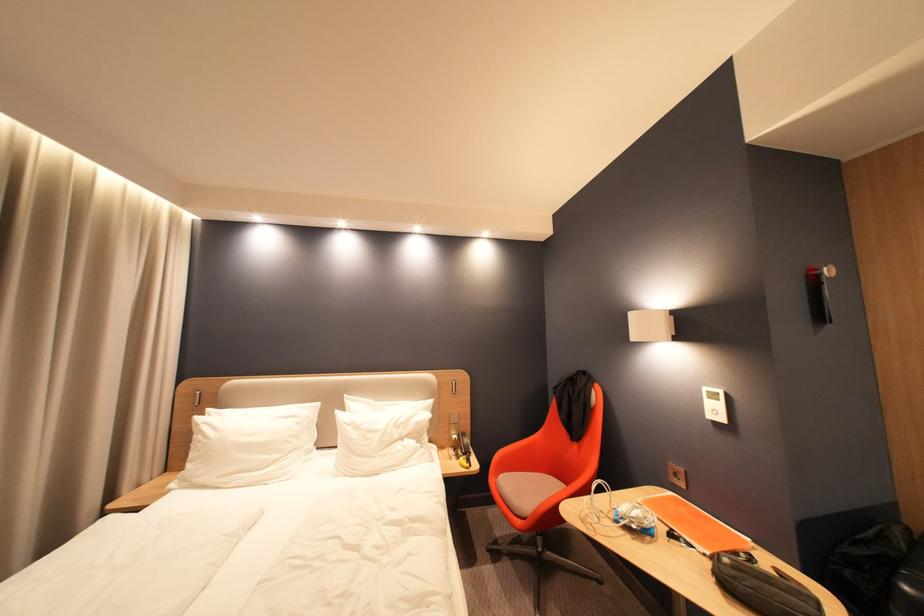
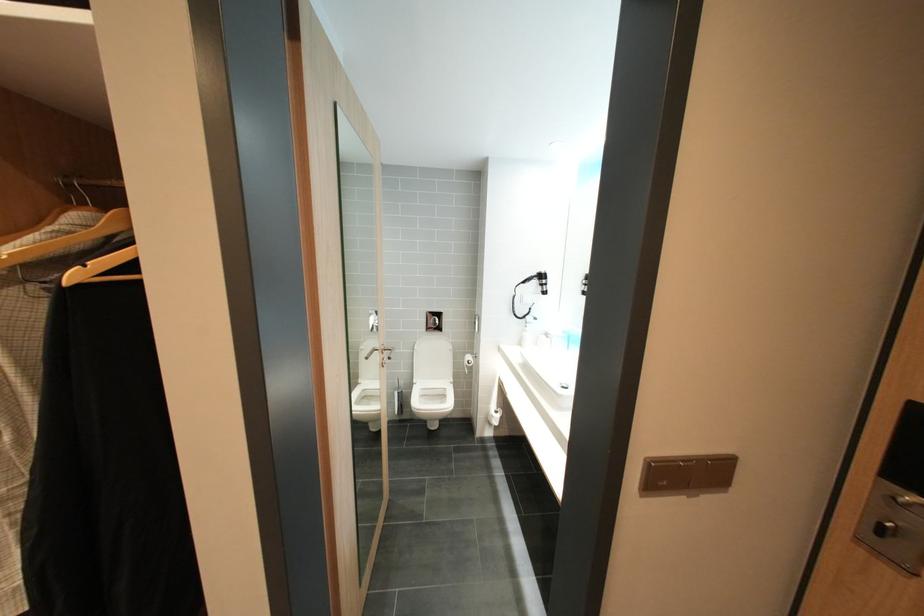
Question: The images are taken continuously from a first-person perspective. In which direction are you moving?

Choices:
 (A) Left
 (B) Right
 (C) Forward
 (D) Backward

Answer: (B)